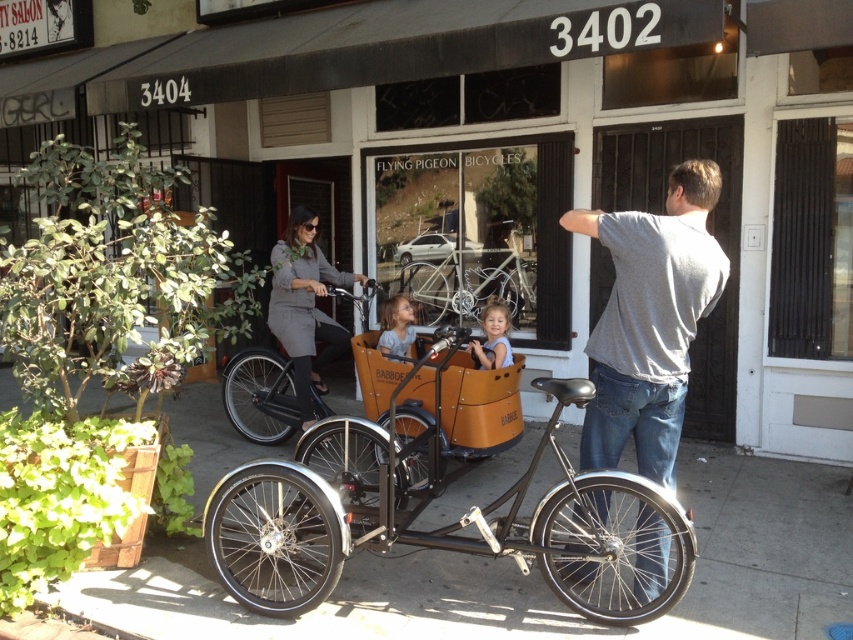
Can you confirm if gray matte dress at center is thinner than matte black bicycle at center?

Yes, gray matte dress at center is thinner than matte black bicycle at center.

Between gray matte dress at center and matte black bicycle at center, which one has more height?

Standing taller between the two is gray matte dress at center.

Locate an element on the screen. The image size is (853, 640). gray matte dress at center is located at coordinates (305, 307).

Between point (508, 236) and point (492, 348), which one is positioned behind?

The point (508, 236) is behind.

Who is positioned more to the right, metallic silver bicycle at center or light blue fabric child at center?

From the viewer's perspective, light blue fabric child at center appears more on the right side.

The image size is (853, 640). In order to click on metallic silver bicycle at center in this screenshot , I will do `click(468, 280)`.

Who is more distant from viewer, (630, 104) or (282, 310)?

Point (630, 104)

Is the position of wooden cargo bike at center less distant than that of gray matte dress at center?

Yes, wooden cargo bike at center is in front of gray matte dress at center.

Find the location of a particular element. wooden cargo bike at center is located at coordinates (498, 150).